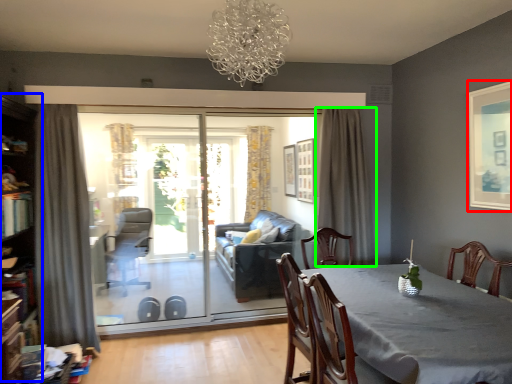
Question: Considering the real-world distances, which object is farthest from picture frame (highlighted by a red box)? bookshelf (highlighted by a blue box) or curtain (highlighted by a green box)?

Choices:
 (A) bookshelf
 (B) curtain

Answer: (A)